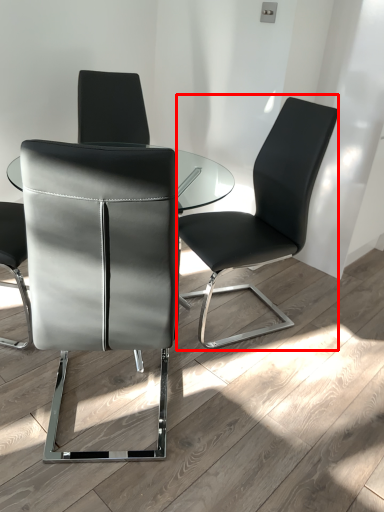
Question: From the image, what is the correct spatial relationship of chair (annotated by the red box) in relation to chair?

Choices:
 (A) right
 (B) left

Answer: (A)